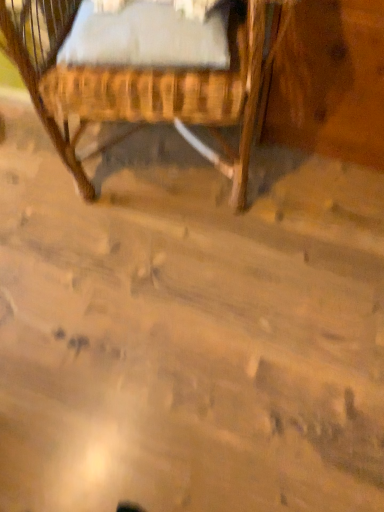
Question: In terms of height, does white soft fabric at upper center look taller or shorter compared to woven wood crib at upper left?

Choices:
 (A) short
 (B) tall

Answer: (A)

Question: From a real-world perspective, relative to woven wood crib at upper left, is white soft fabric at upper center vertically above or below?

Choices:
 (A) above
 (B) below

Answer: (A)

Question: From the image's perspective, relative to woven wood crib at upper left, is white soft fabric at upper center above or below?

Choices:
 (A) below
 (B) above

Answer: (A)

Question: From the image's perspective, is woven wood crib at upper left above or below white soft fabric at upper center?

Choices:
 (A) above
 (B) below

Answer: (A)

Question: Is woven wood crib at upper left inside the boundaries of white soft fabric at upper center, or outside?

Choices:
 (A) inside
 (B) outside

Answer: (B)

Question: From a real-world perspective, relative to white soft fabric at upper center, is woven wood crib at upper left vertically above or below?

Choices:
 (A) above
 (B) below

Answer: (B)

Question: Considering the positions of woven wood crib at upper left and white soft fabric at upper center in the image, is woven wood crib at upper left wider or thinner than white soft fabric at upper center?

Choices:
 (A) wide
 (B) thin

Answer: (A)